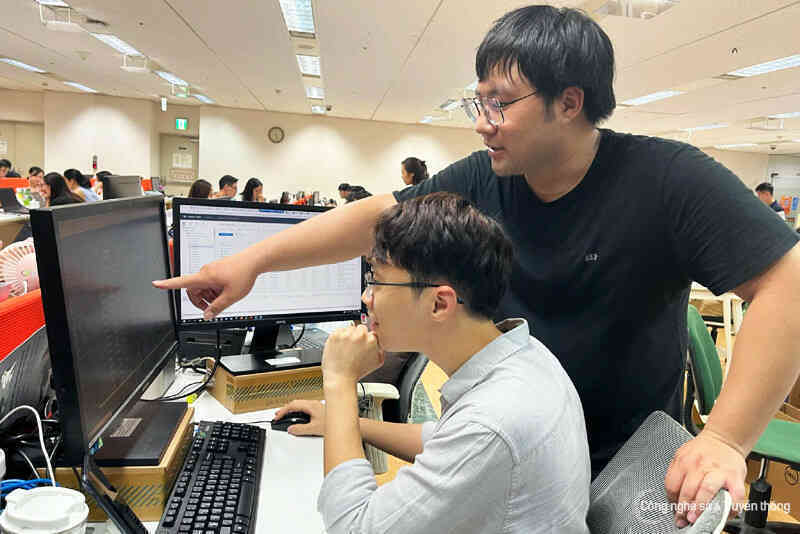
What are the coordinates of `wires` in the screenshot? It's located at (26, 481), (49, 465), (204, 381), (300, 333).